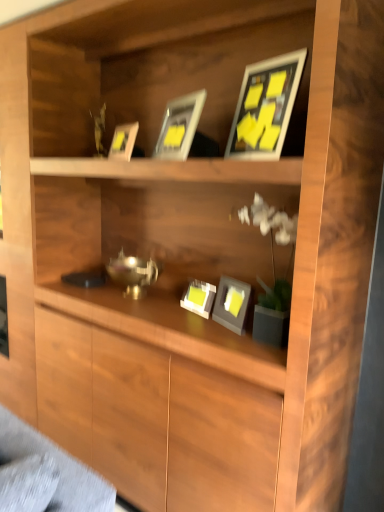
Question: Should I look upward or downward to see matte black picture frame at upper center, acting as the second picture frame starting from the top?

Choices:
 (A) up
 (B) down

Answer: (A)

Question: Are matte silver picture frame at upper center, marked as the 5th picture frame in a bottom-to-top arrangement, and matte gray picture frame at center, which ranks as the second picture frame in bottom-to-top order, making contact?

Choices:
 (A) yes
 (B) no

Answer: (B)

Question: Does matte silver picture frame at upper center, which is counted as the 1th picture frame, starting from the top, have a lesser width compared to matte gray picture frame at center, the fourth picture frame from the top?

Choices:
 (A) no
 (B) yes

Answer: (B)

Question: Does matte silver picture frame at upper center, marked as the 5th picture frame in a bottom-to-top arrangement, appear on the right side of matte gray picture frame at center, which ranks as the second picture frame in bottom-to-top order?

Choices:
 (A) no
 (B) yes

Answer: (A)

Question: Is matte silver picture frame at upper center, marked as the 5th picture frame in a bottom-to-top arrangement, behind matte gray picture frame at center, which ranks as the second picture frame in bottom-to-top order?

Choices:
 (A) no
 (B) yes

Answer: (A)

Question: Considering the relative sizes of matte silver picture frame at upper center, marked as the 5th picture frame in a bottom-to-top arrangement, and matte gray picture frame at center, which ranks as the second picture frame in bottom-to-top order, in the image provided, is matte silver picture frame at upper center, marked as the 5th picture frame in a bottom-to-top arrangement, shorter than matte gray picture frame at center, which ranks as the second picture frame in bottom-to-top order,?

Choices:
 (A) yes
 (B) no

Answer: (B)

Question: Can you confirm if matte silver picture frame at upper center, which is counted as the 1th picture frame, starting from the top, is smaller than matte gray picture frame at center, which ranks as the second picture frame in bottom-to-top order?

Choices:
 (A) yes
 (B) no

Answer: (B)

Question: Does matte black picture frame at upper center, acting as the second picture frame starting from the top, have a smaller size compared to matte gray picture frame at center, placed as the first picture frame when sorted from bottom to top?

Choices:
 (A) no
 (B) yes

Answer: (A)

Question: Is matte black picture frame at upper center, acting as the second picture frame starting from the top, not close to matte gray picture frame at center, placed as the first picture frame when sorted from bottom to top?

Choices:
 (A) no
 (B) yes

Answer: (A)

Question: Does matte black picture frame at upper center, positioned as the fourth picture frame in bottom-to-top order, come behind matte gray picture frame at center, which ranks as the fifth picture frame in top-to-bottom order?

Choices:
 (A) no
 (B) yes

Answer: (A)

Question: From a real-world perspective, is matte black picture frame at upper center, positioned as the fourth picture frame in bottom-to-top order, over matte gray picture frame at center, placed as the first picture frame when sorted from bottom to top?

Choices:
 (A) no
 (B) yes

Answer: (B)

Question: Is matte black picture frame at upper center, acting as the second picture frame starting from the top, at the left side of matte gray picture frame at center, which ranks as the fifth picture frame in top-to-bottom order?

Choices:
 (A) no
 (B) yes

Answer: (A)

Question: Does matte black picture frame at upper center, acting as the second picture frame starting from the top, appear on the right side of matte gray picture frame at center, placed as the first picture frame when sorted from bottom to top?

Choices:
 (A) yes
 (B) no

Answer: (A)

Question: Is matte gray picture frame at center, placed as the first picture frame when sorted from bottom to top, not near matte gray picture frame at center, which ranks as the second picture frame in bottom-to-top order?

Choices:
 (A) no
 (B) yes

Answer: (A)